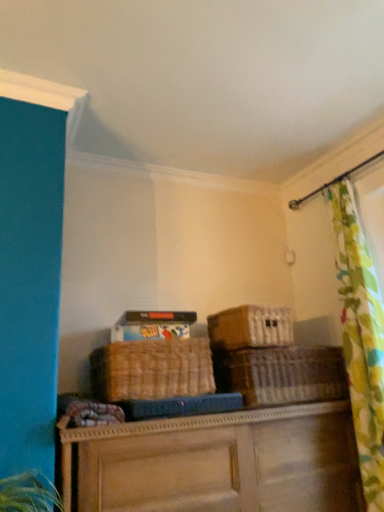
Question: Can you confirm if matte cardboard storage box at upper center is wider than woven brown basket at center, the 3th basket when ordered from left to right?

Choices:
 (A) yes
 (B) no

Answer: (B)

Question: Considering the relative positions of matte cardboard storage box at upper center and woven brown basket at center, the 3th basket when ordered from left to right, in the image provided, is matte cardboard storage box at upper center to the right of woven brown basket at center, the 3th basket when ordered from left to right, from the viewer's perspective?

Choices:
 (A) no
 (B) yes

Answer: (A)

Question: Considering the relative sizes of matte cardboard storage box at upper center and woven brown basket at center, which appears as the 1th basket when viewed from the right, in the image provided, is matte cardboard storage box at upper center bigger than woven brown basket at center, which appears as the 1th basket when viewed from the right,?

Choices:
 (A) no
 (B) yes

Answer: (A)

Question: Does matte cardboard storage box at upper center appear on the left side of woven brown basket at center, which appears as the 1th basket when viewed from the right?

Choices:
 (A) yes
 (B) no

Answer: (A)

Question: Considering the relative sizes of matte cardboard storage box at upper center and woven brown basket at center, which appears as the 1th basket when viewed from the right, in the image provided, is matte cardboard storage box at upper center shorter than woven brown basket at center, which appears as the 1th basket when viewed from the right,?

Choices:
 (A) no
 (B) yes

Answer: (B)

Question: Is point (276, 393) closer or farther from the camera than point (196, 340)?

Choices:
 (A) closer
 (B) farther

Answer: (B)

Question: Considering the positions of woven brown basket at center, which appears as the 1th basket when viewed from the right, and woven brown basket at center, the third basket from the right, in the image, is woven brown basket at center, which appears as the 1th basket when viewed from the right, taller or shorter than woven brown basket at center, the third basket from the right,?

Choices:
 (A) short
 (B) tall

Answer: (A)

Question: Is woven brown basket at center, which appears as the 1th basket when viewed from the right, wider or thinner than woven brown basket at center, the third basket from the right?

Choices:
 (A) thin
 (B) wide

Answer: (B)

Question: Considering their positions, is woven brown basket at center, the 3th basket when ordered from left to right, located in front of or behind woven brown basket at center, which appears as the 1th basket when viewed from the left?

Choices:
 (A) front
 (B) behind

Answer: (B)

Question: Is brown woven basket at center, the 2th basket when ordered from left to right, in front of or behind matte cardboard storage box at upper center in the image?

Choices:
 (A) front
 (B) behind

Answer: (B)

Question: Based on their positions, is brown woven basket at center, arranged as the 2th basket when viewed from the right, located to the left or right of matte cardboard storage box at upper center?

Choices:
 (A) right
 (B) left

Answer: (A)

Question: From their relative heights in the image, would you say brown woven basket at center, the 2th basket when ordered from left to right, is taller or shorter than matte cardboard storage box at upper center?

Choices:
 (A) short
 (B) tall

Answer: (B)

Question: From a real-world perspective, is brown woven basket at center, the 2th basket when ordered from left to right, physically located above or below matte cardboard storage box at upper center?

Choices:
 (A) above
 (B) below

Answer: (B)

Question: Considering their positions, is woven wicker basket at center located in front of or behind brown woven basket at center, the 2th basket when ordered from left to right?

Choices:
 (A) front
 (B) behind

Answer: (A)

Question: Is point (172, 493) positioned closer to the camera than point (288, 323)?

Choices:
 (A) closer
 (B) farther

Answer: (A)